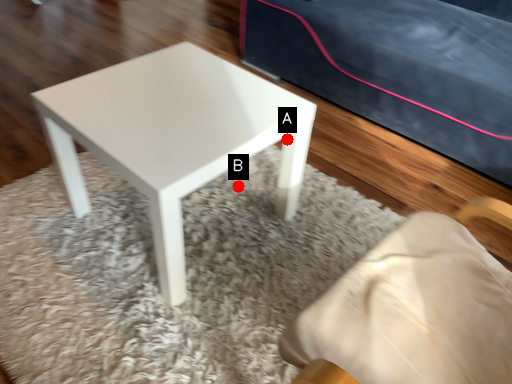
Question: Two points are circled on the image, labeled by A and B beside each circle. Which point is farther from the camera taking this photo?

Choices:
 (A) A is further
 (B) B is further

Answer: (B)